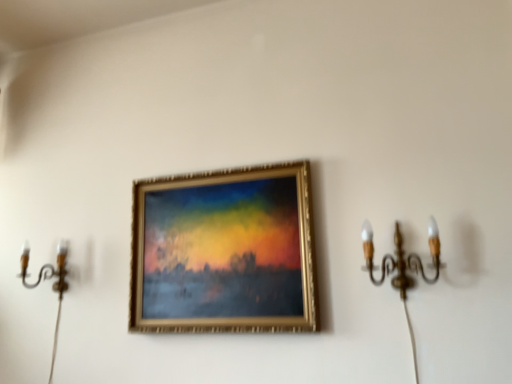
Question: Considering the positions of gold metallic picture frame at center and gold metallic chandelier at right, which appears as the 1th candle holder when viewed from the right, in the image, is gold metallic picture frame at center taller or shorter than gold metallic chandelier at right, which appears as the 1th candle holder when viewed from the right,?

Choices:
 (A) short
 (B) tall

Answer: (B)

Question: Considering the positions of gold metallic picture frame at center and gold metallic chandelier at right, which is the first candle holder from front to back, in the image, is gold metallic picture frame at center bigger or smaller than gold metallic chandelier at right, which is the first candle holder from front to back,?

Choices:
 (A) big
 (B) small

Answer: (A)

Question: Estimate the real-world distances between objects in this image. Which object is farther from the gold metallic candle holder at left, placed as the 2th candle holder when sorted from right to left?

Choices:
 (A) gold metallic picture frame at center
 (B) gold metallic chandelier at right, which appears as the 1th candle holder when viewed from the right

Answer: (B)

Question: Estimate the real-world distances between objects in this image. Which object is closer to the gold metallic chandelier at right, which is the first candle holder from front to back?

Choices:
 (A) gold metallic picture frame at center
 (B) gold metallic candle holder at left, acting as the first candle holder starting from the back

Answer: (A)